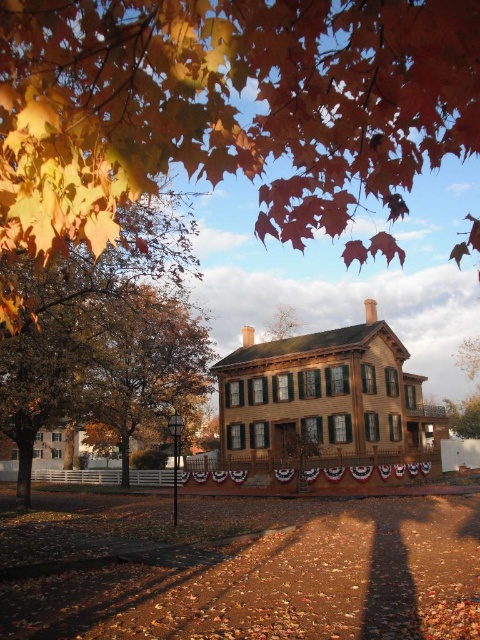
Looking at this image, can you confirm if golden leafy tree at upper left is bigger than brown wooden house at center?

Correct, golden leafy tree at upper left is larger in size than brown wooden house at center.

Who is positioned more to the left, golden leafy tree at upper left or brown wooden house at center?

golden leafy tree at upper left is more to the left.

Who is more distant from viewer, (38,320) or (336,346)?

The point (336,346) is behind.

Identify the location of golden leafy tree at upper left. (104, 332).

This screenshot has width=480, height=640. What do you see at coordinates (228, 106) in the screenshot?
I see `golden matte leaf at upper left` at bounding box center [228, 106].

Where is `golden matte leaf at upper left`? This screenshot has height=640, width=480. golden matte leaf at upper left is located at coordinates (228, 106).

Can you confirm if golden matte leaf at upper left is positioned to the left of brown wooden house at center?

Yes, golden matte leaf at upper left is to the left of brown wooden house at center.

Is golden matte leaf at upper left in front of brown wooden house at center?

Yes, it is.

Between point (324, 80) and point (219, 403), which one is positioned in front?

Point (324, 80)

Where is `golden matte leaf at upper left`? golden matte leaf at upper left is located at coordinates (228, 106).